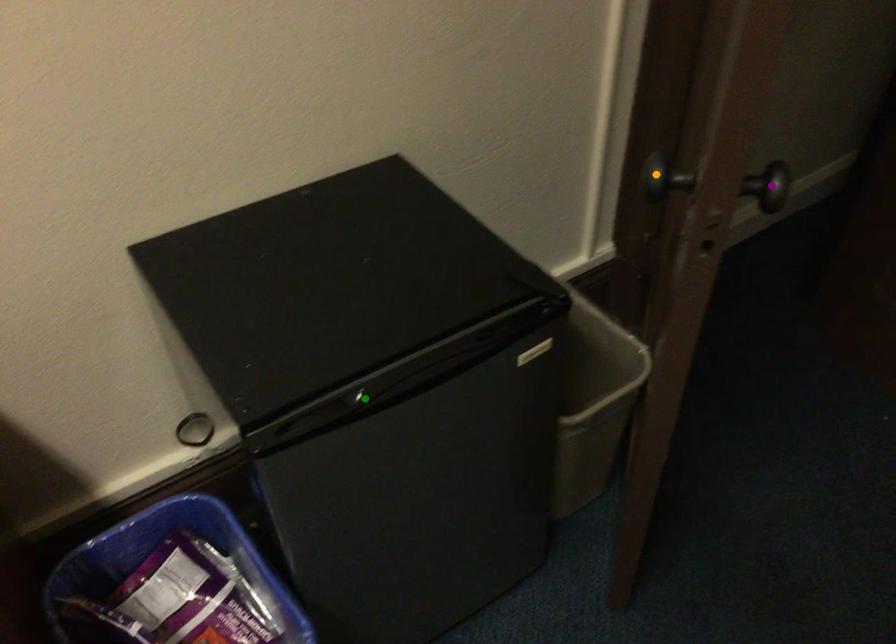
Looking at this image, order these from farthest to nearest:
A) purple point
B) orange point
C) green point

A: green point → orange point → purple point